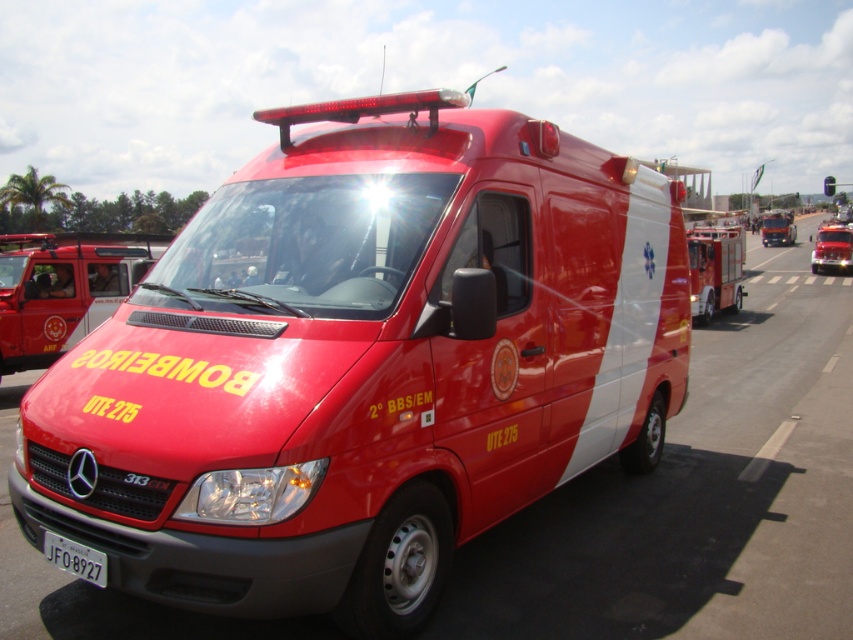
Question: From the image, what is the correct spatial relationship of shiny red fire truck at left in relation to shiny red fire truck at right?

Choices:
 (A) right
 (B) left

Answer: (B)

Question: Which is farther from the shiny red fire truck at right?

Choices:
 (A) shiny red van at center
 (B) shiny red fire truck at left

Answer: (A)

Question: Does shiny red fire truck at left appear over white plastic license plate at lower center?

Choices:
 (A) yes
 (B) no

Answer: (A)

Question: Estimate the real-world distances between objects in this image. Which object is closer to the shiny red van at center?

Choices:
 (A) shiny red fire truck at left
 (B) white plastic license plate at lower center
 (C) shiny red fire truck at right

Answer: (B)

Question: Does shiny red fire truck at left appear over white plastic license plate at lower center?

Choices:
 (A) yes
 (B) no

Answer: (A)

Question: Which point is farther to the camera?

Choices:
 (A) (138, 248)
 (B) (163, 419)
 (C) (67, 563)
 (D) (720, 260)

Answer: (D)